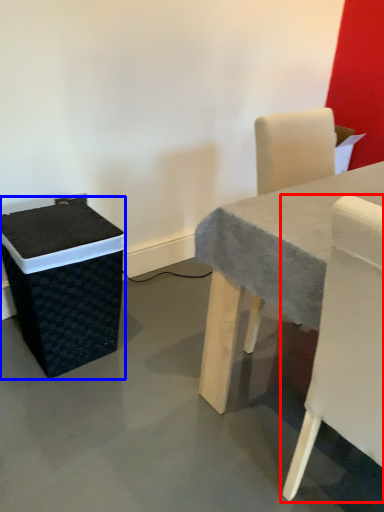
Question: Which of the following is the farthest to the observer, chair (highlighted by a red box) or storage box (highlighted by a blue box)?

Choices:
 (A) chair
 (B) storage box

Answer: (B)